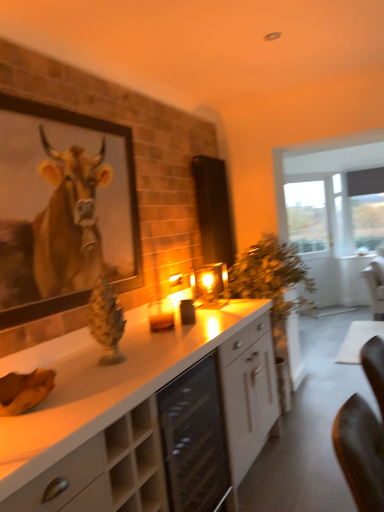
Question: Considering the relative sizes of matte black screen door at center and beige wood cabinet at lower left, which ranks as the first cabinetry in front-to-back order, in the image provided, is matte black screen door at center thinner than beige wood cabinet at lower left, which ranks as the first cabinetry in front-to-back order,?

Choices:
 (A) no
 (B) yes

Answer: (B)

Question: From a real-world perspective, does matte black screen door at center stand above beige wood cabinet at lower left, the second cabinetry positioned from the back?

Choices:
 (A) yes
 (B) no

Answer: (A)

Question: Is matte black screen door at center outside beige wood cabinet at lower left, which ranks as the first cabinetry in front-to-back order?

Choices:
 (A) no
 (B) yes

Answer: (B)

Question: Is beige wood cabinet at lower left, the second cabinetry positioned from the back, inside matte black screen door at center?

Choices:
 (A) yes
 (B) no

Answer: (B)

Question: Does matte black screen door at center lie behind beige wood cabinet at lower left, the second cabinetry positioned from the back?

Choices:
 (A) no
 (B) yes

Answer: (B)

Question: Relative to white glossy cabinet at center, acting as the 2th cabinetry starting from the front, is matte gray curtain at right in front or behind?

Choices:
 (A) behind
 (B) front

Answer: (A)

Question: Looking at the image, does matte gray curtain at right seem bigger or smaller compared to white glossy cabinet at center, acting as the 2th cabinetry starting from the front?

Choices:
 (A) big
 (B) small

Answer: (B)

Question: From their relative heights in the image, would you say matte gray curtain at right is taller or shorter than white glossy cabinet at center, acting as the 2th cabinetry starting from the front?

Choices:
 (A) tall
 (B) short

Answer: (A)

Question: From the image's perspective, relative to white glossy cabinet at center, acting as the 2th cabinetry starting from the front, is matte gray curtain at right above or below?

Choices:
 (A) below
 (B) above

Answer: (B)

Question: Looking at their shapes, would you say white glossy cabinet at center, positioned as the first cabinetry in back-to-front order, is wider or thinner than matte gray curtain at right?

Choices:
 (A) wide
 (B) thin

Answer: (A)

Question: From the image's perspective, is white glossy cabinet at center, positioned as the first cabinetry in back-to-front order, positioned above or below matte gray curtain at right?

Choices:
 (A) above
 (B) below

Answer: (B)

Question: From a real-world perspective, is white glossy cabinet at center, positioned as the first cabinetry in back-to-front order, above or below matte gray curtain at right?

Choices:
 (A) below
 (B) above

Answer: (A)

Question: Is point (59, 488) positioned closer to the camera than point (357, 241)?

Choices:
 (A) farther
 (B) closer

Answer: (B)

Question: Is beige wood cabinet at lower left, which ranks as the first cabinetry in front-to-back order, wider or thinner than matte gray curtain at right?

Choices:
 (A) wide
 (B) thin

Answer: (A)

Question: Considering the positions of point (127, 419) and point (360, 223), is point (127, 419) closer or farther from the camera than point (360, 223)?

Choices:
 (A) closer
 (B) farther

Answer: (A)